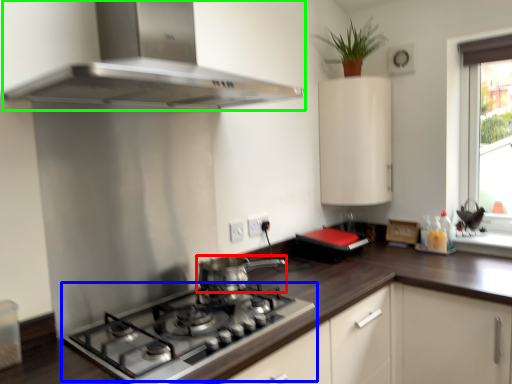
Question: Which object is the closest to the kitchen appliance (highlighted by a red box)? Choose among these: gas stove (highlighted by a blue box) or home appliance (highlighted by a green box).

Choices:
 (A) gas stove
 (B) home appliance

Answer: (A)